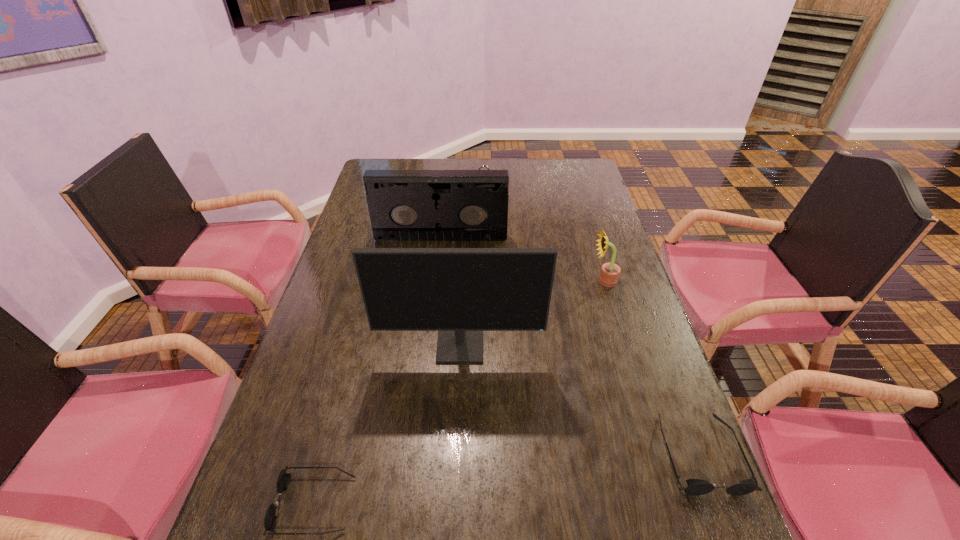
Locate an element on the screen. Image resolution: width=960 pixels, height=540 pixels. blank region between the second shortest object and the third farthest object is located at coordinates (652, 367).

This screenshot has width=960, height=540. In order to click on free spot between the taller sunglasses and the padlock in this screenshot , I will do `click(591, 320)`.

Where is `free space between the tallest object and the second shortest object`? free space between the tallest object and the second shortest object is located at coordinates (580, 400).

Locate an element on the screen. The height and width of the screenshot is (540, 960). empty space between the third nearest object and the left sunglasses is located at coordinates (388, 426).

Select which object is the closest to the tallest object. Please provide its 2D coordinates. Your answer should be formatted as a tuple, i.e. [(x, y)], where the tuple contains the x and y coordinates of a point satisfying the conditions above.

[(610, 272)]

Where is `the second closest object to the padlock`? The image size is (960, 540). the second closest object to the padlock is located at coordinates (610, 272).

The image size is (960, 540). Identify the location of free spot that satisfies the following two spatial constraints: 1. on the face of the fourth nearest object; 2. on the front-facing side of the third nearest object. (624, 347).